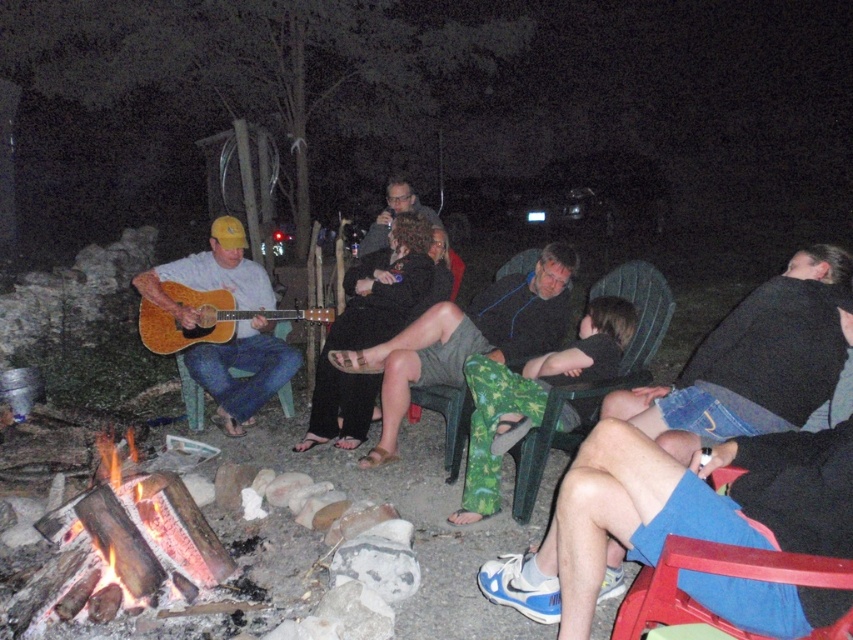
Is charcoal wood fire at lower left to the right of wooden acoustic guitar at left from the viewer's perspective?

Indeed, charcoal wood fire at lower left is positioned on the right side of wooden acoustic guitar at left.

Which is behind, point (51, 592) or point (260, 273)?

The point (260, 273) is behind.

Who is more distant from viewer, (103, 461) or (227, 346)?

Positioned behind is point (227, 346).

Where is `charcoal wood fire at lower left`? charcoal wood fire at lower left is located at coordinates pos(131,544).

You are a GUI agent. You are given a task and a screenshot of the screen. Output one action in this format:
    pyautogui.click(x=<x>, y=<y>)
    Task: Click on the acoustic wood guitar at left
    This screenshot has width=853, height=640.
    Given the screenshot: What is the action you would take?
    pyautogui.click(x=206, y=317)

Locate an element on the screen. The height and width of the screenshot is (640, 853). acoustic wood guitar at left is located at coordinates (206, 317).

Where is `acoustic wood guitar at left`? The image size is (853, 640). acoustic wood guitar at left is located at coordinates (206, 317).

Can you confirm if charcoal wood fire at lower left is positioned to the right of matte black shirt at center?

In fact, charcoal wood fire at lower left is to the left of matte black shirt at center.

Who is positioned more to the left, charcoal wood fire at lower left or matte black shirt at center?

From the viewer's perspective, charcoal wood fire at lower left appears more on the left side.

At what (x,y) coordinates should I click in order to perform the action: click on charcoal wood fire at lower left. Please return your answer as a coordinate pair (x, y). Image resolution: width=853 pixels, height=640 pixels. Looking at the image, I should click on (131, 544).